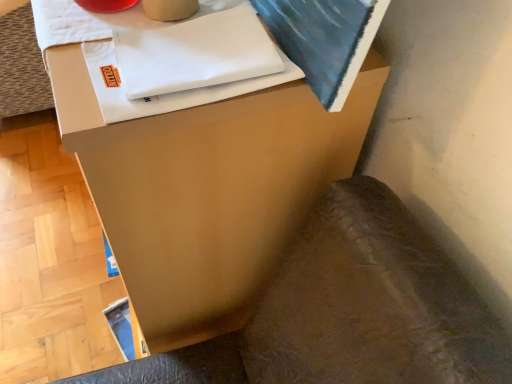
Question: Can you confirm if brown leather swivel chair at lower right is shorter than matte brown side table at center?

Choices:
 (A) no
 (B) yes

Answer: (B)

Question: Are brown leather swivel chair at lower right and matte brown side table at center beside each other?

Choices:
 (A) yes
 (B) no

Answer: (B)

Question: From the image's perspective, does brown leather swivel chair at lower right appear lower than matte brown side table at center?

Choices:
 (A) yes
 (B) no

Answer: (A)

Question: Is brown leather swivel chair at lower right taller than matte brown side table at center?

Choices:
 (A) no
 (B) yes

Answer: (A)

Question: Is brown leather swivel chair at lower right to the right of matte brown side table at center from the viewer's perspective?

Choices:
 (A) no
 (B) yes

Answer: (B)

Question: Considering the relative positions of brown leather swivel chair at lower right and matte brown side table at center in the image provided, is brown leather swivel chair at lower right behind matte brown side table at center?

Choices:
 (A) yes
 (B) no

Answer: (B)

Question: From the image's perspective, would you say matte brown side table at center is shown under brown leather swivel chair at lower right?

Choices:
 (A) no
 (B) yes

Answer: (A)

Question: Does matte brown side table at center touch brown leather swivel chair at lower right?

Choices:
 (A) yes
 (B) no

Answer: (B)

Question: Is matte brown side table at center outside of brown leather swivel chair at lower right?

Choices:
 (A) yes
 (B) no

Answer: (A)

Question: Is matte brown side table at center to the right of brown leather swivel chair at lower right from the viewer's perspective?

Choices:
 (A) no
 (B) yes

Answer: (A)

Question: Can you confirm if matte brown side table at center is smaller than brown leather swivel chair at lower right?

Choices:
 (A) no
 (B) yes

Answer: (A)

Question: Does matte brown side table at center have a greater width compared to brown leather swivel chair at lower right?

Choices:
 (A) no
 (B) yes

Answer: (A)

Question: Is point (228, 82) closer or farther from the camera than point (394, 205)?

Choices:
 (A) closer
 (B) farther

Answer: (A)